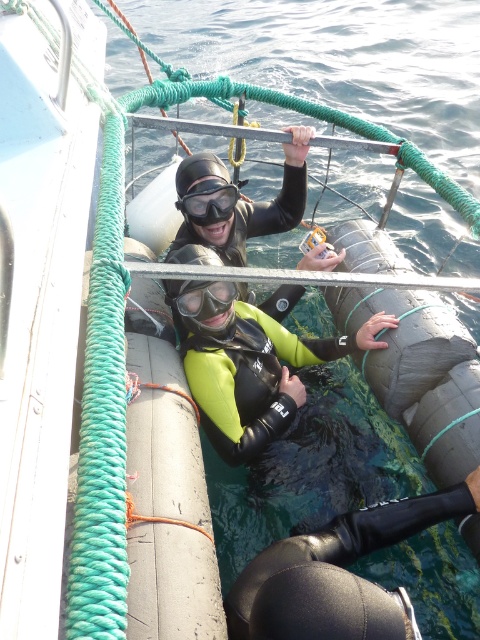
In the diving scene, there are two pairs of goggles at the center of the image. The first pair is labeled as black matte goggles at center, and the second pair is labeled as matte black goggles at center. Which pair is taller?

The black matte goggles at center are taller than the matte black goggles at center.

In the scene shown: You are a safety inspector assessing the diving platform setup. The safety guidelines state that all equipment must be at least 1 meter apart to prevent entanglement. Are the neon green neoprene wetsuit at center and the black matte goggles at center compliant with this regulation?

The neon green neoprene wetsuit at center is 82.25 centimeters from the black matte goggles at center. Since 82.25 cm is less than 1 meter, they are not compliant with the safety guidelines requiring at least 1 meter distance to prevent entanglement.

You are a lifeguard assessing safety gear on the platform. You notice the neon green neoprene wetsuit at center and the black matte goggles at center. Which item would you say is bigger?

The neon green neoprene wetsuit at center is larger in size than the black matte goggles at center.